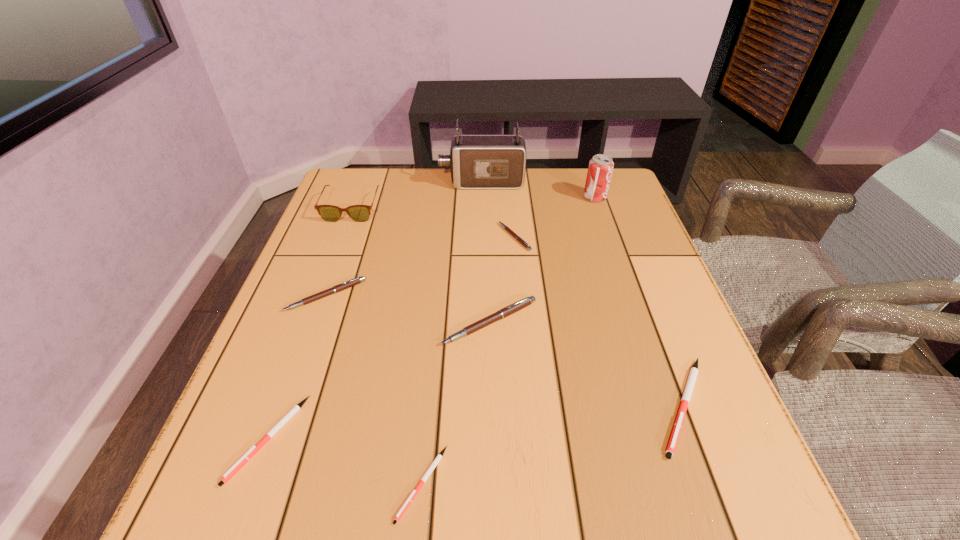
Where is `camcorder`? The image size is (960, 540). camcorder is located at coordinates (477, 161).

Locate an element on the screen. the farthest object is located at coordinates (477, 161).

The image size is (960, 540). Identify the location of the second tallest object. (600, 169).

Image resolution: width=960 pixels, height=540 pixels. I want to click on pink soda can, so click(x=600, y=169).

Locate an element on the screen. The image size is (960, 540). the seventh shortest object is located at coordinates (360, 213).

You are a GUI agent. You are given a task and a screenshot of the screen. Output one action in this format:
    pyautogui.click(x=<x>, y=<y>)
    Task: Click on the brown spectacles
    
    Given the screenshot: What is the action you would take?
    pyautogui.click(x=360, y=213)

Image resolution: width=960 pixels, height=540 pixels. I want to click on the tallest pen, so click(512, 308).

What are the coordinates of `the biggest pink pen` in the screenshot? It's located at (512, 308).

Locate an element on the screen. The width and height of the screenshot is (960, 540). the leftmost pink pen is located at coordinates (357, 280).

What are the coordinates of `the rightmost white pen` in the screenshot? It's located at (687, 393).